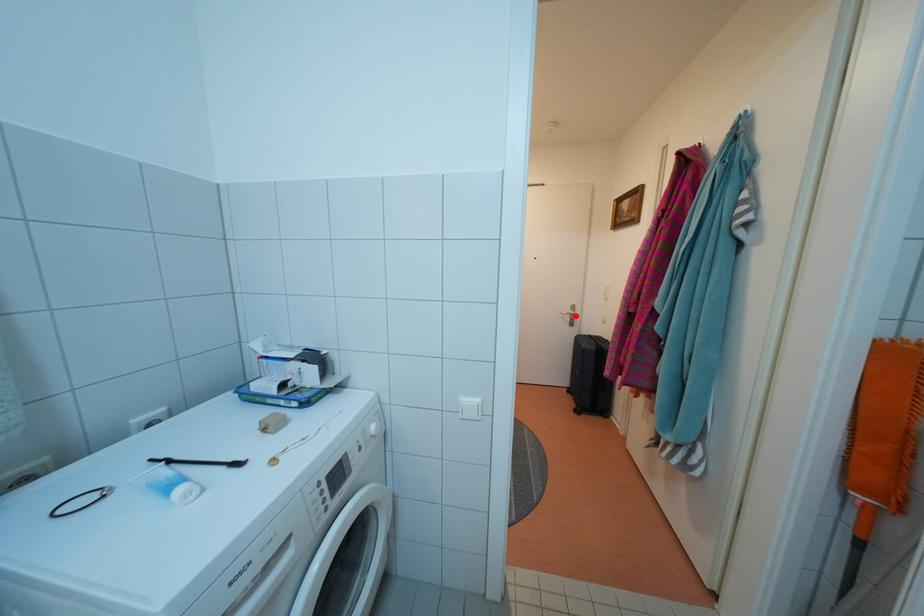
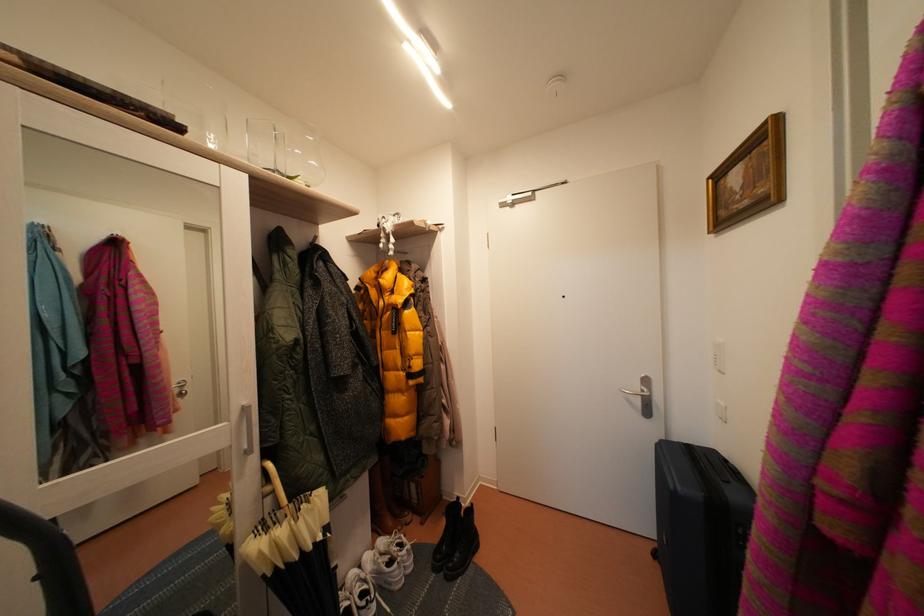
Question: I am providing you with two images of the same scene from different viewpoints. Image1 has a red point marked. In image2, the corresponding 3D location appears at what relative position? Reply with the corresponding letter.

Choices:
 (A) Closer
 (B) Farther

Answer: (B)